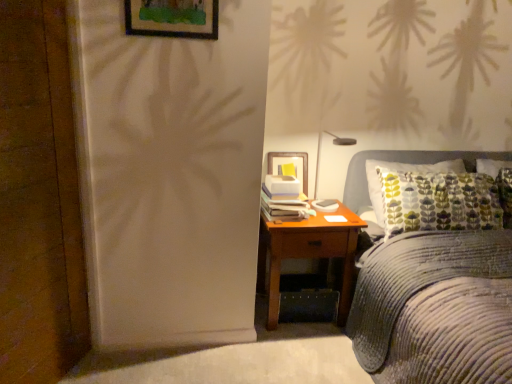
Question: From a real-world perspective, relative to matte black lamp at upper right, is corduroy fabric bed at right vertically above or below?

Choices:
 (A) below
 (B) above

Answer: (A)

Question: Does point (457, 354) appear closer or farther from the camera than point (316, 175)?

Choices:
 (A) farther
 (B) closer

Answer: (B)

Question: Which of these objects is positioned closest to the wooden picture frame at upper center?

Choices:
 (A) brown wooden nightstand at right
 (B) corduroy fabric bed at right
 (C) matte black lamp at upper right

Answer: (A)

Question: Estimate the real-world distances between objects in this image. Which object is closer to the corduroy fabric bed at right?

Choices:
 (A) wooden picture frame at upper center
 (B) matte black lamp at upper right
 (C) brown wooden nightstand at right

Answer: (C)